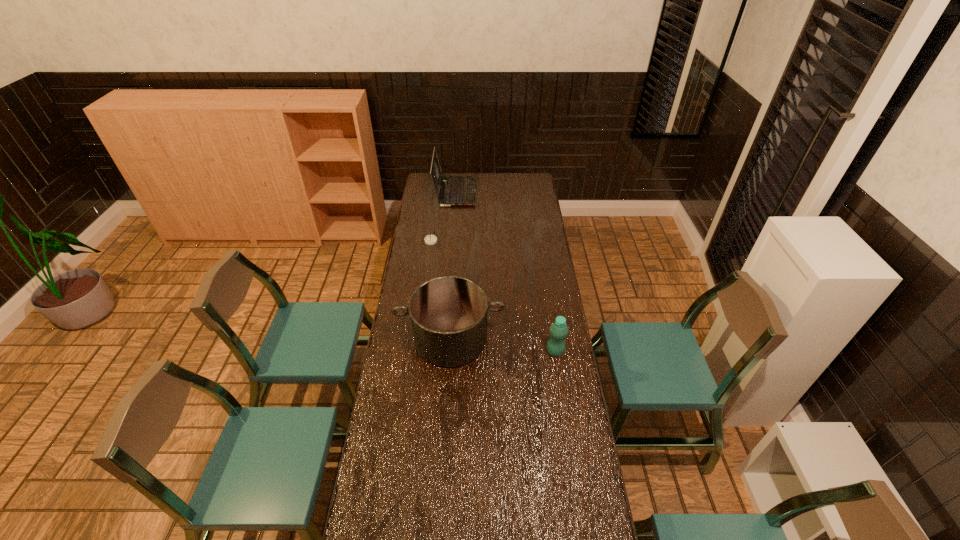
Where is `free point between the shortest object and the farthest object`? This screenshot has height=540, width=960. free point between the shortest object and the farthest object is located at coordinates (443, 217).

At what (x,y) coordinates should I click in order to perform the action: click on unoccupied position between the water bottle and the pan. Please return your answer as a coordinate pair (x, y). The height and width of the screenshot is (540, 960). Looking at the image, I should click on (503, 345).

Identify the location of free space between the rightmost object and the farthest object. Image resolution: width=960 pixels, height=540 pixels. 505,272.

Where is `free space between the farthest object and the pan`? This screenshot has width=960, height=540. free space between the farthest object and the pan is located at coordinates (453, 265).

Where is `vacant point located between the farthest object and the rightmost object`? Image resolution: width=960 pixels, height=540 pixels. vacant point located between the farthest object and the rightmost object is located at coordinates (505, 272).

Locate an element on the screen. vacant region between the pan and the rightmost object is located at coordinates (503, 345).

The height and width of the screenshot is (540, 960). In order to click on vacant area that lies between the pan and the rightmost object in this screenshot , I will do `click(503, 345)`.

Locate an element on the screen. The width and height of the screenshot is (960, 540). free point between the compass and the water bottle is located at coordinates (493, 296).

Locate an element on the screen. The height and width of the screenshot is (540, 960). vacant region between the compass and the laptop computer is located at coordinates (443, 217).

This screenshot has height=540, width=960. Identify the location of free space between the water bottle and the pan. (503, 345).